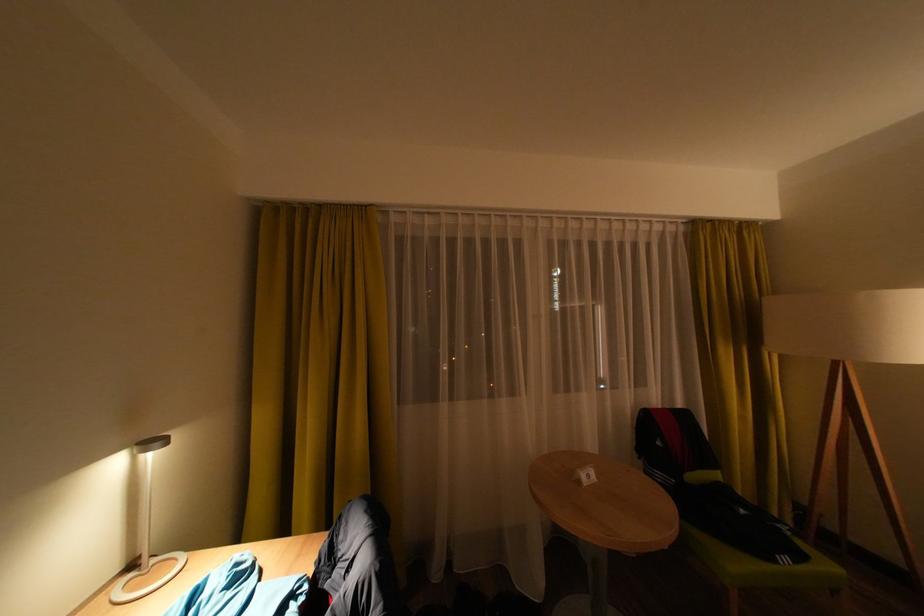
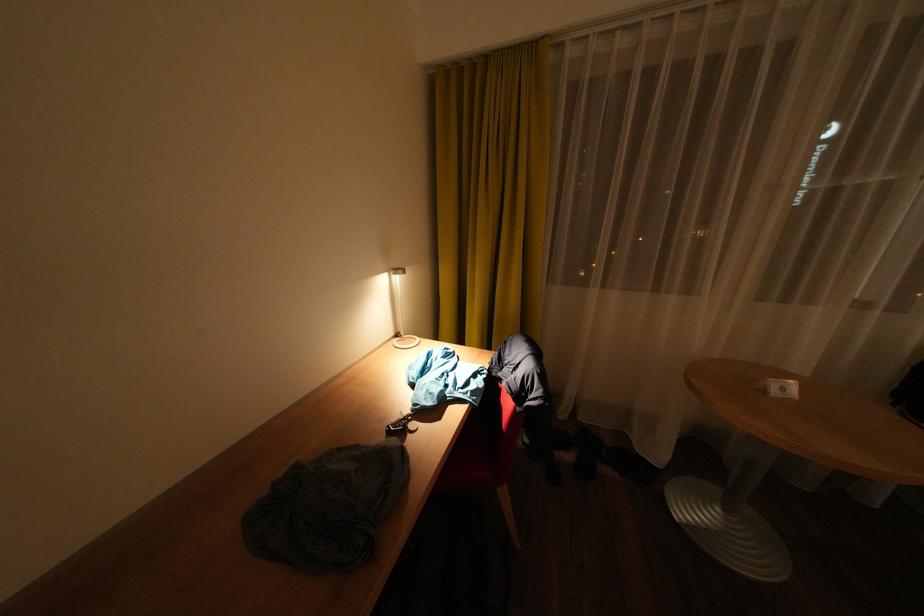
Find the pixel in the second image that matches (x=600, y=477) in the first image.

(794, 390)